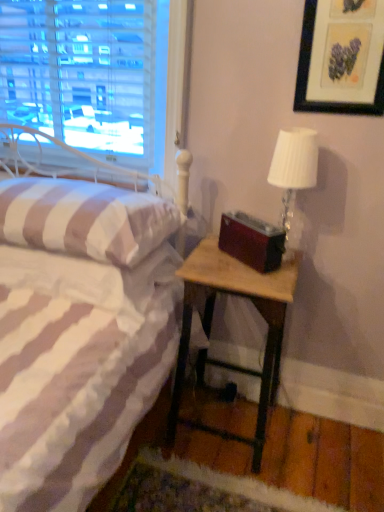
Locate an element on the screen. Image resolution: width=384 pixels, height=512 pixels. free spot to the right of wooden nightstand at lower right is located at coordinates (320, 448).